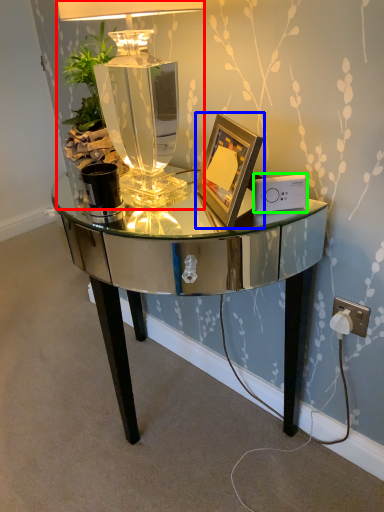
Question: Which object is positioned closest to lamp (highlighted by a red box)? Select from picture frame (highlighted by a blue box) and ipod (highlighted by a green box).

Choices:
 (A) picture frame
 (B) ipod

Answer: (A)